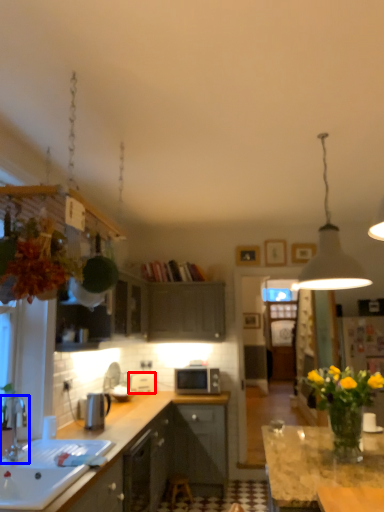
Question: Which object is closer to the camera taking this photo, appliance (highlighted by a red box) or tap (highlighted by a blue box)?

Choices:
 (A) appliance
 (B) tap

Answer: (B)